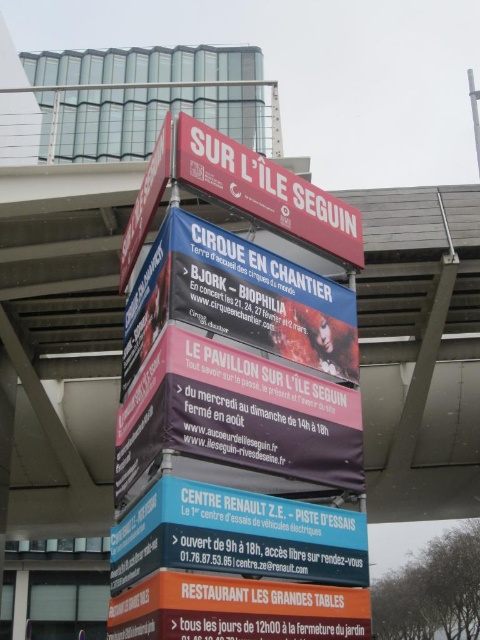
Which of these two, matte red sign at upper center or blue plastic sign at center, stands taller?

With more height is matte red sign at upper center.

Can you confirm if matte red sign at upper center is positioned to the right of blue plastic sign at center?

Indeed, matte red sign at upper center is positioned on the right side of blue plastic sign at center.

This screenshot has width=480, height=640. Identify the location of matte red sign at upper center. (237, 444).

Can you confirm if matte red sign at upper center is positioned to the left of red matte sign at upper center?

Correct, you'll find matte red sign at upper center to the left of red matte sign at upper center.

Can you confirm if matte red sign at upper center is smaller than red matte sign at upper center?

Actually, matte red sign at upper center might be larger than red matte sign at upper center.

Image resolution: width=480 pixels, height=640 pixels. Describe the element at coordinates (237, 444) in the screenshot. I see `matte red sign at upper center` at that location.

You are a GUI agent. You are given a task and a screenshot of the screen. Output one action in this format:
    pyautogui.click(x=<x>, y=<y>)
    Task: Click on the matte red sign at upper center
    
    Given the screenshot: What is the action you would take?
    pyautogui.click(x=237, y=444)

Is blue plastic sign at center below white plastic sign at upper center?

Yes, blue plastic sign at center is below white plastic sign at upper center.

Who is more distant from viewer, (x=163, y=518) or (x=132, y=266)?

The point (x=132, y=266) is more distant.

The width and height of the screenshot is (480, 640). What are the coordinates of `blue plastic sign at center` in the screenshot? It's located at (237, 536).

The width and height of the screenshot is (480, 640). Find the location of `blue plastic sign at center`. blue plastic sign at center is located at coordinates 237,536.